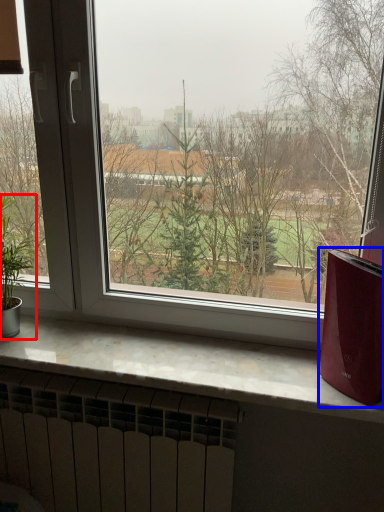
Question: Among these objects, which one is nearest to the camera, houseplant (highlighted by a red box) or appliance (highlighted by a blue box)?

Choices:
 (A) houseplant
 (B) appliance

Answer: (B)